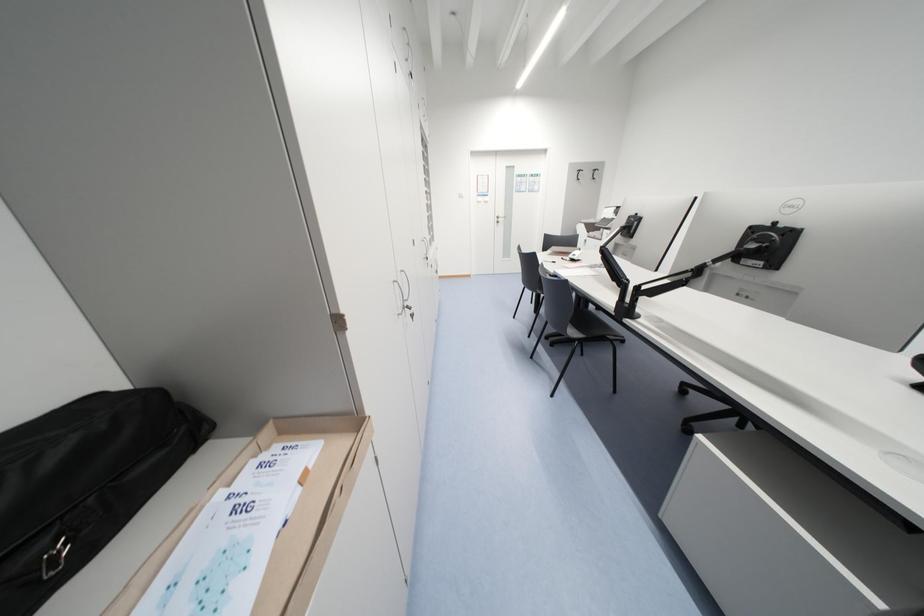
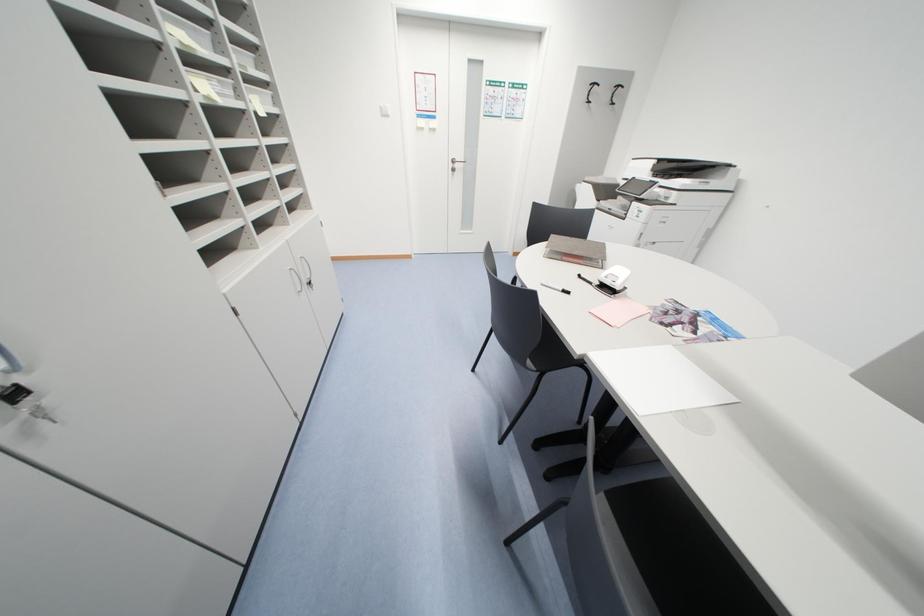
Question: Which direction would the cameraman need to move to produce the second image? Reply with the corresponding letter.

Choices:
 (A) Left
 (B) Right
 (C) Forward
 (D) Backward

Answer: (C)